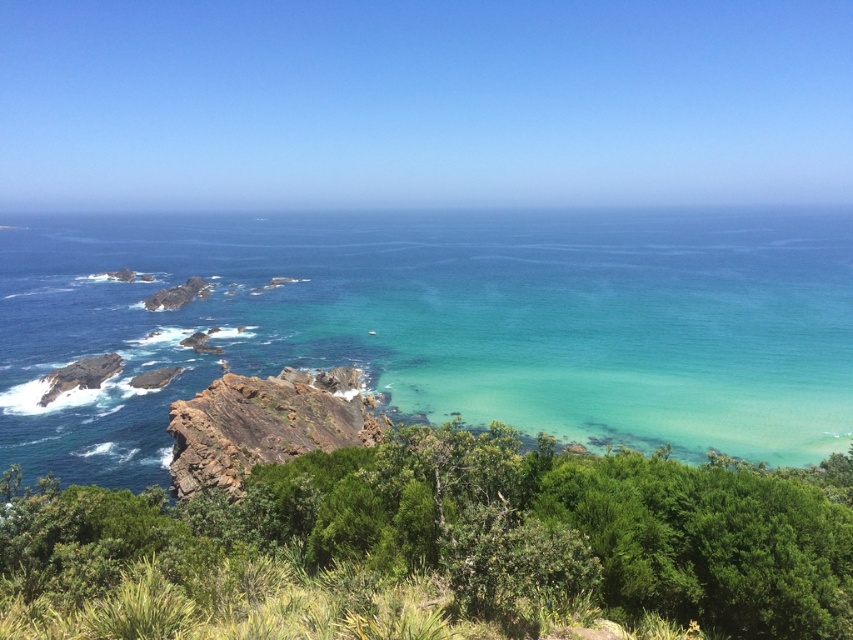
Does point (372, 332) come behind point (631, 570)?

Yes, point (372, 332) is farther from viewer.

Consider the image. Between clear blue water at center and green leafy shrubs at lower center, which one has more height?

clear blue water at center is taller.

Who is more distant from viewer, (445,417) or (729,554)?

The point (445,417) is behind.

Where is `clear blue water at center`? This screenshot has height=640, width=853. clear blue water at center is located at coordinates (444, 324).

Between point (496, 269) and point (225, 413), which one is positioned in front?

Point (225, 413) is more forward.

Is point (28, 304) farther from viewer compared to point (194, 433)?

Yes, point (28, 304) is farther from viewer.

I want to click on clear blue water at center, so click(x=444, y=324).

Identify the location of clear blue water at center. (444, 324).

Is point (622, 532) closer to viewer compared to point (252, 440)?

Yes, it is in front of point (252, 440).

Who is shorter, green leafy shrubs at lower center or rusty rock at center?

Standing shorter between the two is rusty rock at center.

Who is more forward, (316, 468) or (223, 413)?

Positioned in front is point (316, 468).

Locate an element on the screen. This screenshot has width=853, height=640. green leafy shrubs at lower center is located at coordinates (479, 531).